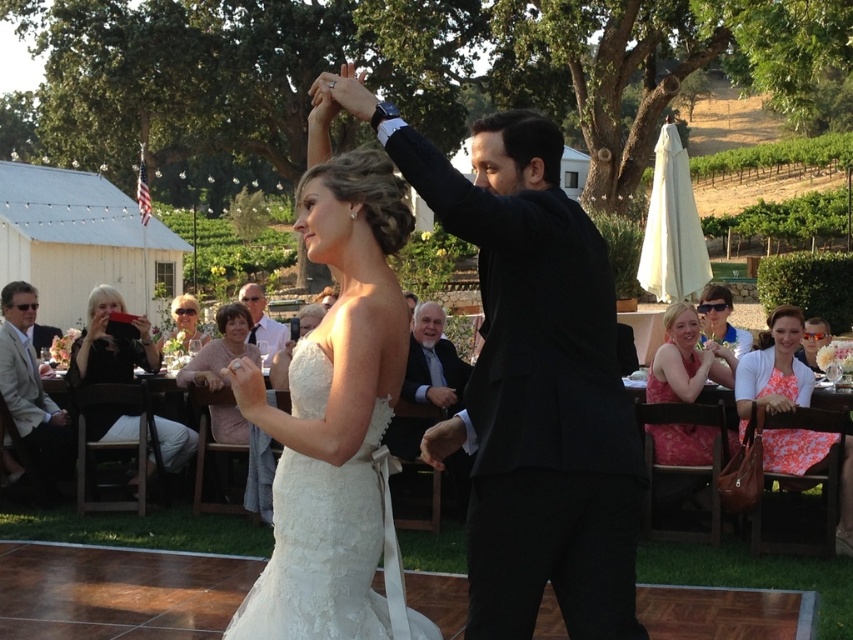
You are a photographer at the wedding reception and want to capture a photo of the pink satin dress at lower right and the light brown hair at upper center. Which object is narrower in width?

The pink satin dress at lower right is narrower in width than the light brown hair at upper center.

You are a photographer at the wedding reception. You need to capture a photo of the bride in her white satin dress at center and the black fabric camera at left. Considering their heights, which one should you focus on first to ensure both are in frame?

The white satin dress at center is taller than the black fabric camera at left, so you should focus on the white satin dress at center first to ensure both are in frame.

You are a photographer at the wedding reception. You need to capture a photo of both the white lace dress at center and the matte black suit at center. Which one appears larger in the photo?

The white lace dress at center appears larger in the photo because it is closer to the viewer than the matte black suit at center.